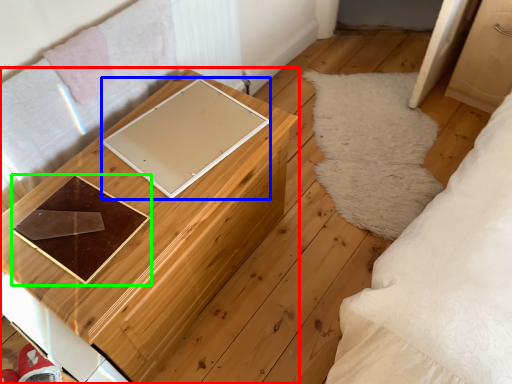
Question: Based on their relative distances, which object is farther from furniture (highlighted by a red box)? Choose from pad (highlighted by a blue box) and tray (highlighted by a green box).

Choices:
 (A) pad
 (B) tray

Answer: (B)